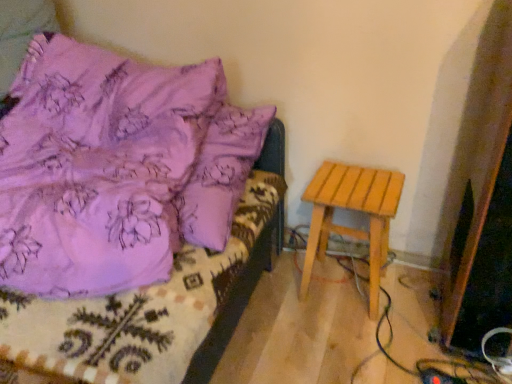
Locate an element on the screen. The image size is (512, 384). free space above light brown wooden stool at right (from a real-world perspective) is located at coordinates coord(361,179).